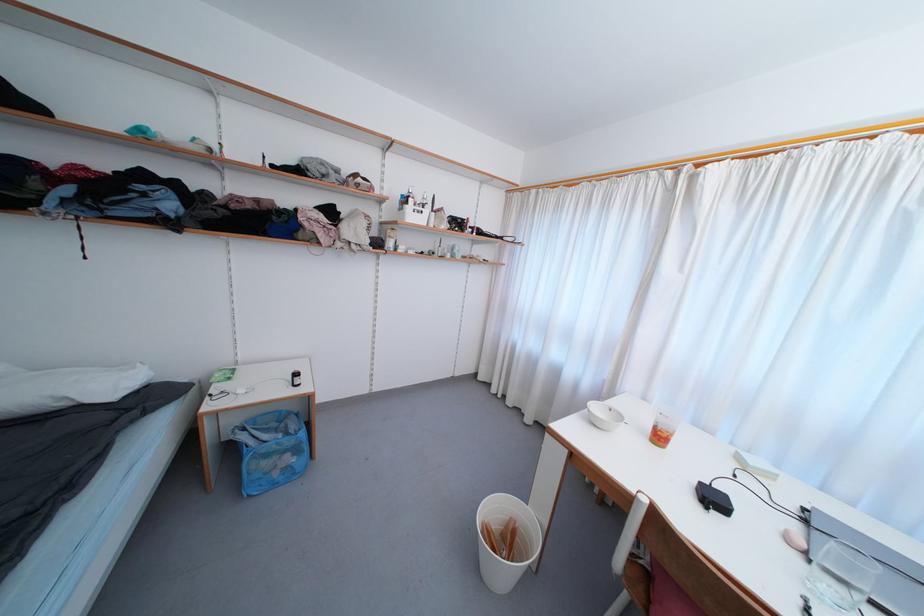
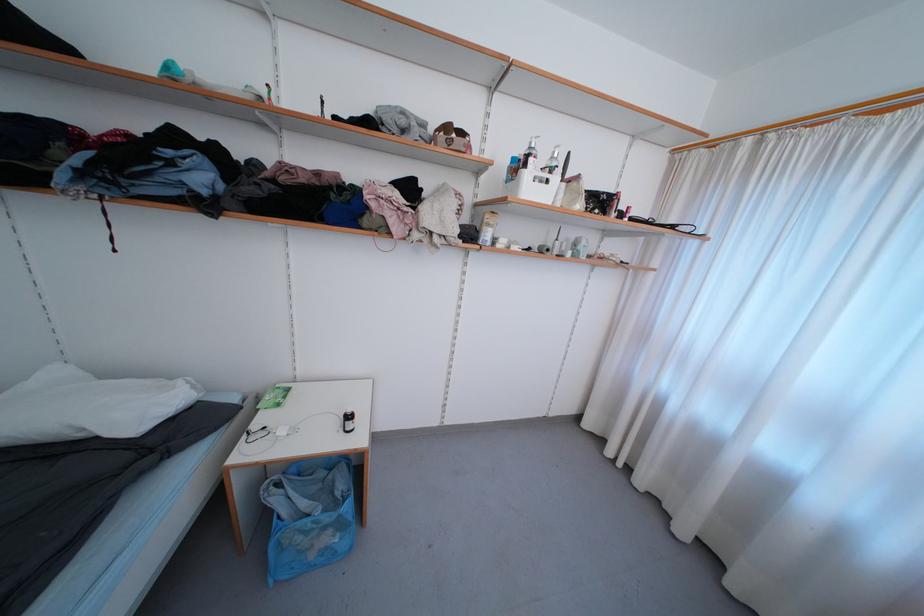
Question: Based on the continuous images, in which direction is the camera rotating? Reply with the corresponding letter.

Choices:
 (A) Left
 (B) Right
 (C) Up
 (D) Down

Answer: (A)